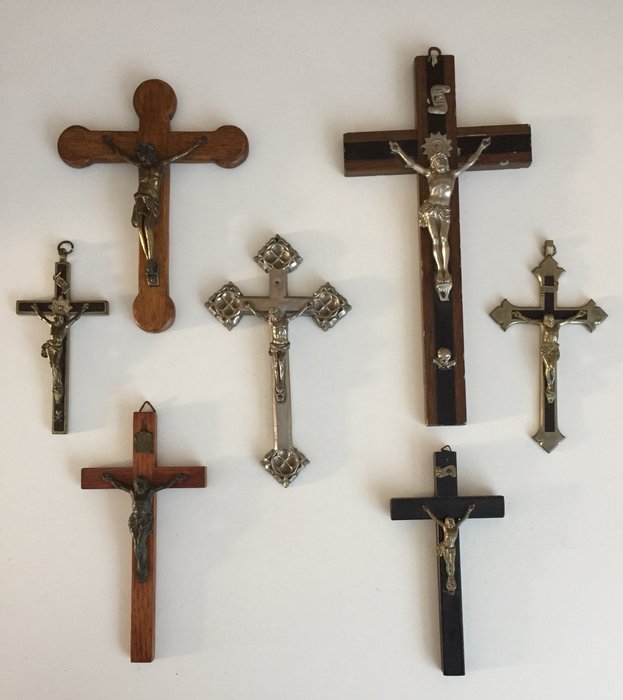
I want to click on statue, so click(x=505, y=172), click(x=449, y=545), click(x=143, y=504), click(x=55, y=312), click(x=278, y=337), click(x=553, y=337), click(x=439, y=197), click(x=146, y=190).